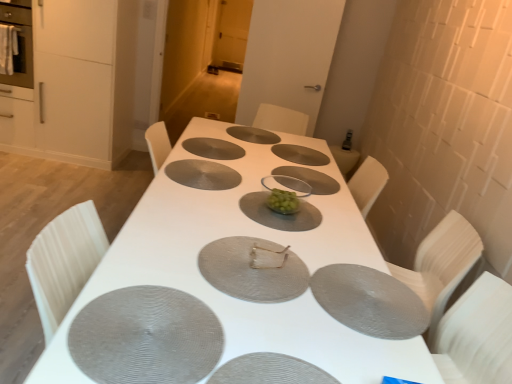
The height and width of the screenshot is (384, 512). Identify the location of vacant space in between gray textured placemat at center, the 5th pizza pan in the front-to-back sequence, and gray textured placemat at center, placed as the 7th pizza pan when sorted from back to front. (177, 221).